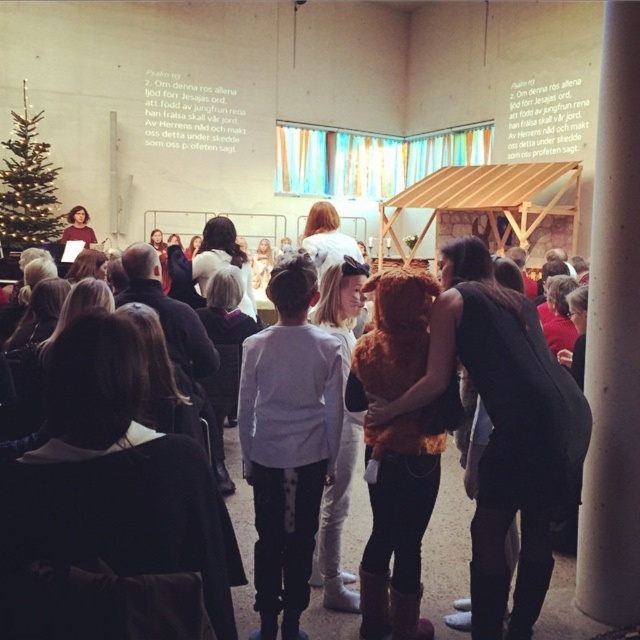
Question: Where is white soft sweater at center located in relation to brown furry coat at center in the image?

Choices:
 (A) left
 (B) right

Answer: (A)

Question: Which point appears closest to the camera in this image?

Choices:
 (A) (112, 332)
 (B) (428, 292)

Answer: (A)

Question: Is dark brown hair at center to the left of white fur coat at center from the viewer's perspective?

Choices:
 (A) yes
 (B) no

Answer: (A)

Question: Estimate the real-world distances between objects in this image. Which object is farther from the white fluffy coat at center?

Choices:
 (A) matte black dress at center
 (B) matte black shirt at left
 (C) brown furry costume at center
 (D) white fur coat at center

Answer: (C)

Question: Is dark brown hair at center positioned at the back of light brown hair at center?

Choices:
 (A) no
 (B) yes

Answer: (A)

Question: Which point is farther to the camera?

Choices:
 (A) (317, 236)
 (B) (252, 397)
 (C) (252, 268)
 (D) (486, 326)

Answer: (C)